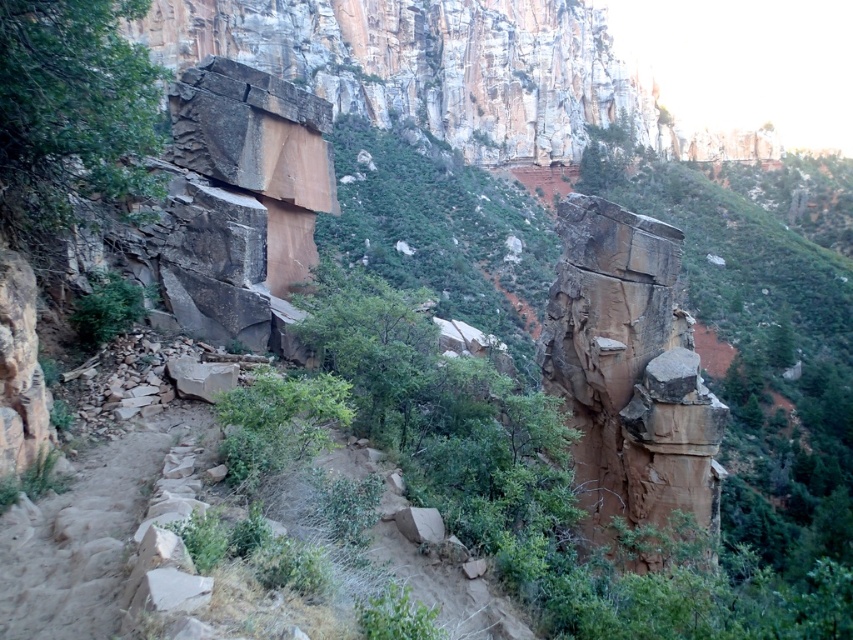
You are standing at point (630,372) in this rugged landscape. Based on the scene description, what type of terrain feature are you currently on?

You are on the brown rough rock at center, as the point (630,372) is located there according to the description.